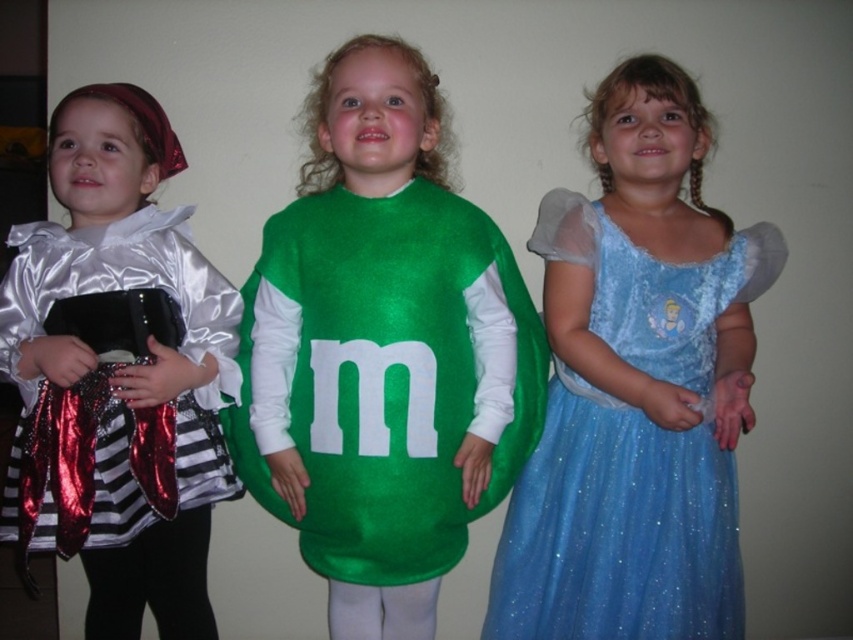
From the picture: Does shiny silver dress at left have a greater width compared to glittery blue dress at center?

No, shiny silver dress at left is not wider than glittery blue dress at center.

Locate an element on the screen. shiny silver dress at left is located at coordinates (x=119, y=376).

Between point (258, 444) and point (654, 292), which one is positioned in front?

Positioned in front is point (258, 444).

Who is positioned more to the right, green shiny candy at center or glittery blue dress at center?

Positioned to the right is glittery blue dress at center.

Between point (476, 419) and point (711, 300), which one is positioned behind?

The point (711, 300) is more distant.

Locate an element on the screen. Image resolution: width=853 pixels, height=640 pixels. green shiny candy at center is located at coordinates click(x=384, y=349).

Is green shiny candy at center positioned in front of shiny silver dress at left?

Yes, it is in front of shiny silver dress at left.

The height and width of the screenshot is (640, 853). What do you see at coordinates (384, 349) in the screenshot?
I see `green shiny candy at center` at bounding box center [384, 349].

Identify the location of green shiny candy at center. (384, 349).